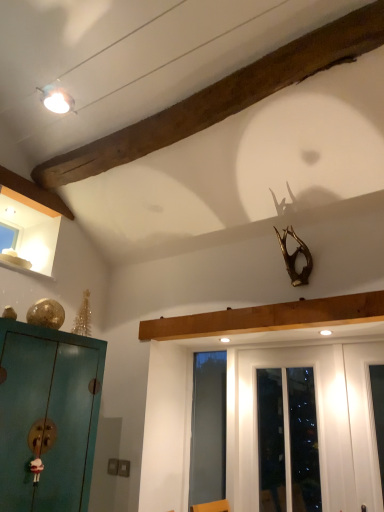
Question: Is transparent glass screen door at center in front of or behind wooden beam at upper left in the image?

Choices:
 (A) front
 (B) behind

Answer: (B)

Question: Is point pos(200,461) positioned closer to the camera than point pos(261,60)?

Choices:
 (A) farther
 (B) closer

Answer: (A)

Question: Estimate the real-world distances between objects in this image. Which object is closer to the wooden beam at upper left?

Choices:
 (A) transparent glass screen door at center
 (B) white glossy door at center
 (C) matte white light fixture at upper left
 (D) teal matte cabinet at left

Answer: (C)

Question: Which object is the closest to the teal matte cabinet at left?

Choices:
 (A) white glossy door at center
 (B) wooden beam at upper left
 (C) matte white light fixture at upper left
 (D) transparent glass screen door at center

Answer: (D)